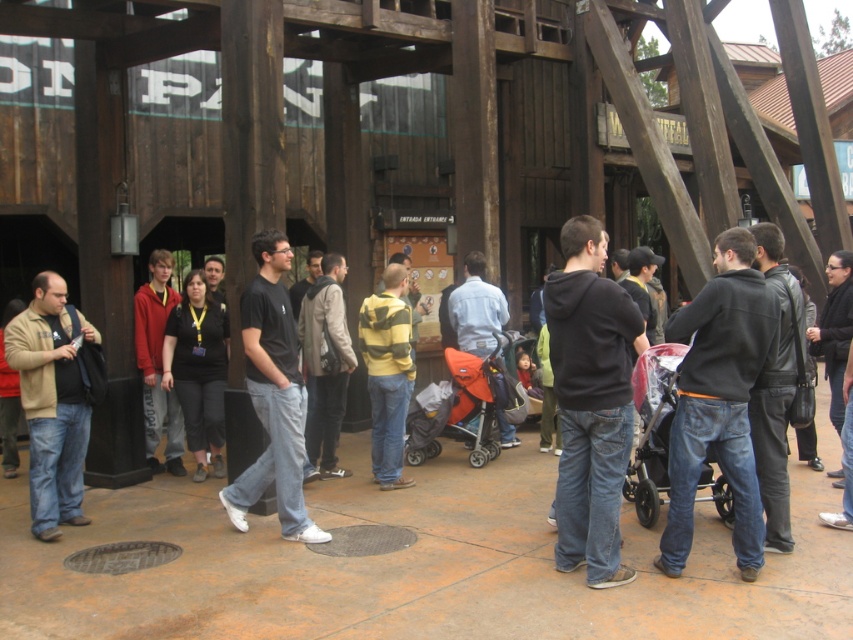
You are a photographer trying to capture both the striped hoodie at center and the denim jacket at center in the same frame. Since you want to highlight the smaller item, which one should you focus on to ensure it stands out more?

The striped hoodie at center has a lesser width compared to denim jacket at center, so focusing on the striped hoodie at center will help it stand out more as it is the smaller item.

You are a photographer trying to capture a photo of the matte red hoodie at center and the transparent plastic baby carriage at center. Since you want to focus on the baby carriage, which object should you adjust your camera to prioritize in terms of focus distance?

The transparent plastic baby carriage at center is closer to the viewer than the matte red hoodie at center, so you should adjust your camera to focus on the transparent plastic baby carriage at center first.